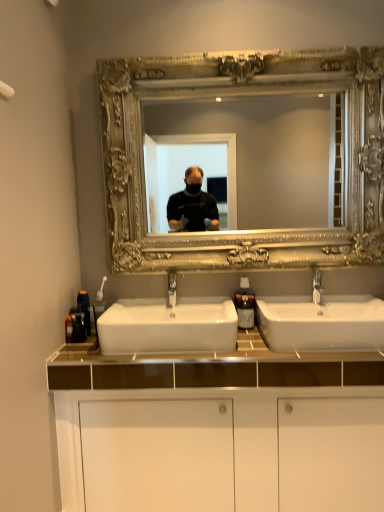
This screenshot has width=384, height=512. I want to click on vacant space that is to the left of silver metallic faucet at center, so click(287, 309).